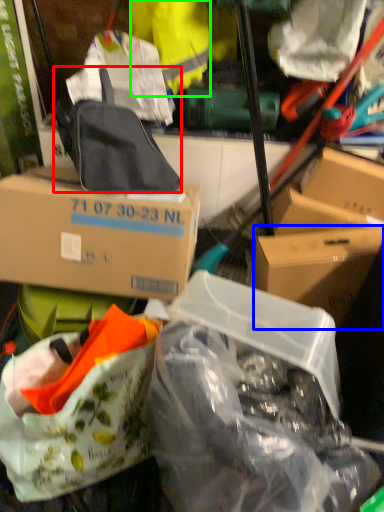
Question: Based on their relative distances, which object is nearer to backpack (highlighted by a red box)? Choose from box (highlighted by a blue box) and clothing (highlighted by a green box).

Choices:
 (A) box
 (B) clothing

Answer: (B)